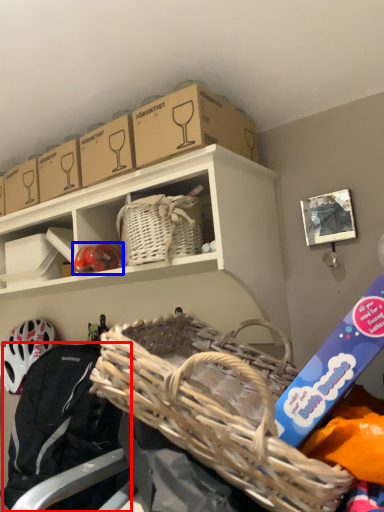
Question: Which object is closer to the camera taking this photo, clothing (highlighted by a red box) or bicycle helmet (highlighted by a blue box)?

Choices:
 (A) clothing
 (B) bicycle helmet

Answer: (A)